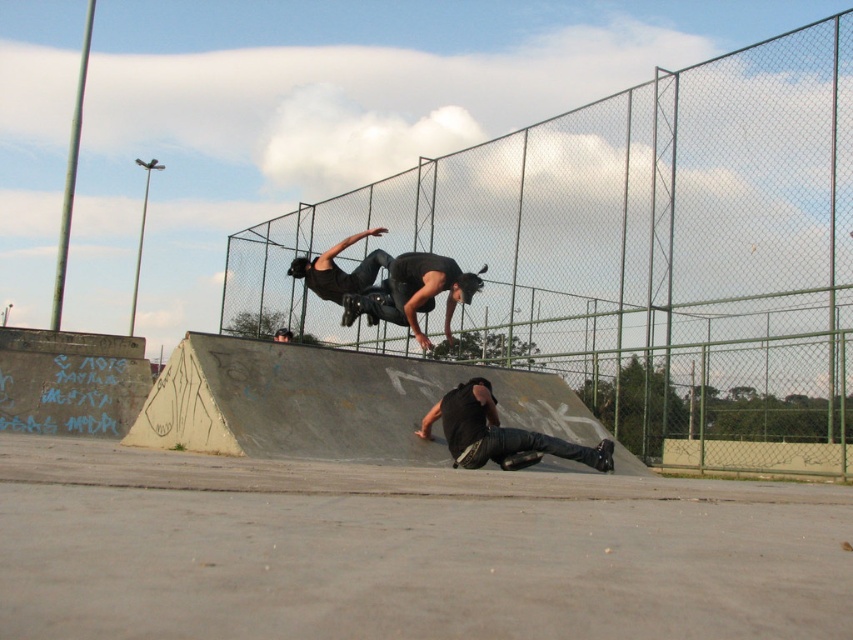
You are a photographer at the skatepark and want to capture a photo of the black matte skateboarder at center and the black matte pants at lower center. From the photographer perspective, which object should be positioned to the left in the frame?

The black matte skateboarder at center is to the left of the black matte pants at lower center, so in the frame, the black matte skateboarder at center should be positioned to the left.